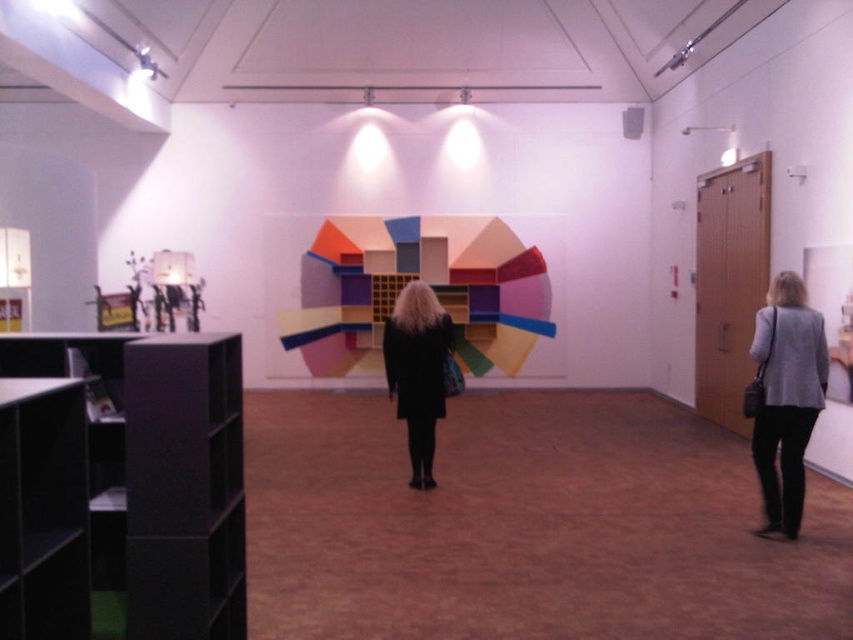
Is matte black bookshelf at left wider than black matte coat at center?

Yes, matte black bookshelf at left is wider than black matte coat at center.

Does matte black bookshelf at left lie in front of black matte coat at center?

Yes, matte black bookshelf at left is in front of black matte coat at center.

Does point (80, 342) come farther from viewer compared to point (426, 448)?

That is False.

This screenshot has width=853, height=640. In order to click on matte black bookshelf at left in this screenshot , I will do `click(160, 472)`.

Can you confirm if multicolored painted geometric shapes at center is taller than black matte coat at center?

Yes.

Does multicolored painted geometric shapes at center have a larger size compared to black matte coat at center?

Correct, multicolored painted geometric shapes at center is larger in size than black matte coat at center.

Is point (305, 273) behind point (386, 349)?

Yes, point (305, 273) is behind point (386, 349).

Where is `multicolored painted geometric shapes at center`? The width and height of the screenshot is (853, 640). multicolored painted geometric shapes at center is located at coordinates (404, 284).

Can you confirm if matte black bookshelf at left is taller than gray fabric jacket at lower right?

Incorrect, matte black bookshelf at left's height is not larger of gray fabric jacket at lower right's.

Is matte black bookshelf at left to the left of gray fabric jacket at lower right from the viewer's perspective?

Yes, matte black bookshelf at left is to the left of gray fabric jacket at lower right.

Find the location of a particular element. matte black bookshelf at left is located at coordinates (160, 472).

Identify the location of matte black bookshelf at left. (160, 472).